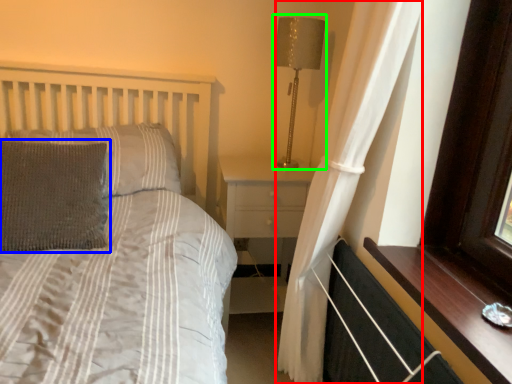
Question: Based on their relative distances, which object is nearer to curtain (highlighted by a red box)? Choose from pillow (highlighted by a blue box) and table lamp (highlighted by a green box).

Choices:
 (A) pillow
 (B) table lamp

Answer: (B)